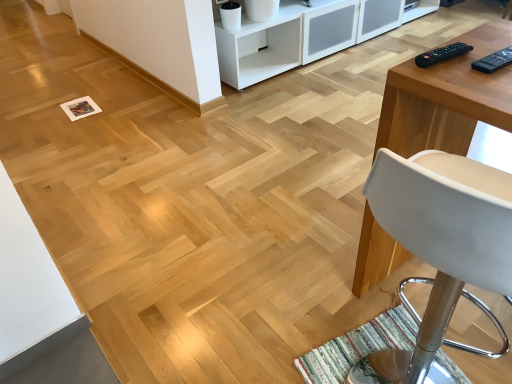
What are the coordinates of `light wood table at right` in the screenshot? It's located at (446, 98).

The height and width of the screenshot is (384, 512). What do you see at coordinates (446, 98) in the screenshot?
I see `light wood table at right` at bounding box center [446, 98].

This screenshot has height=384, width=512. I want to click on light wood table at right, so click(x=446, y=98).